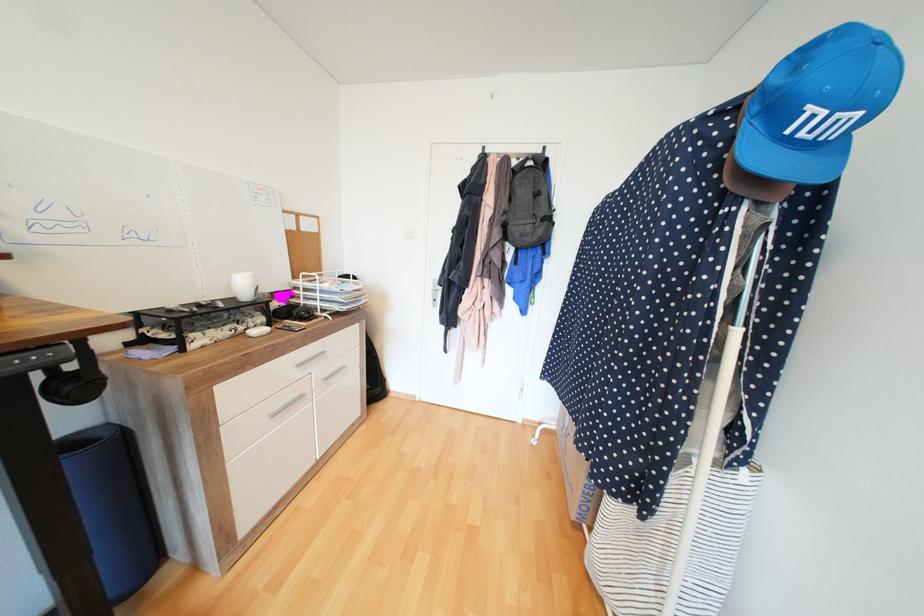
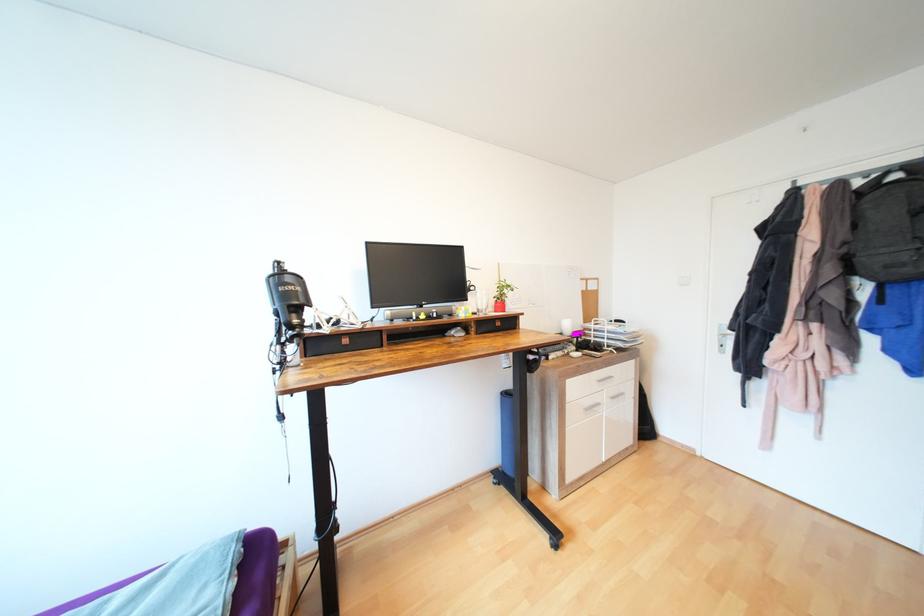
Question: Based on the continuous images, in which direction is the camera rotating? Reply with the corresponding letter.

Choices:
 (A) Left
 (B) Right
 (C) Up
 (D) Down

Answer: (A)